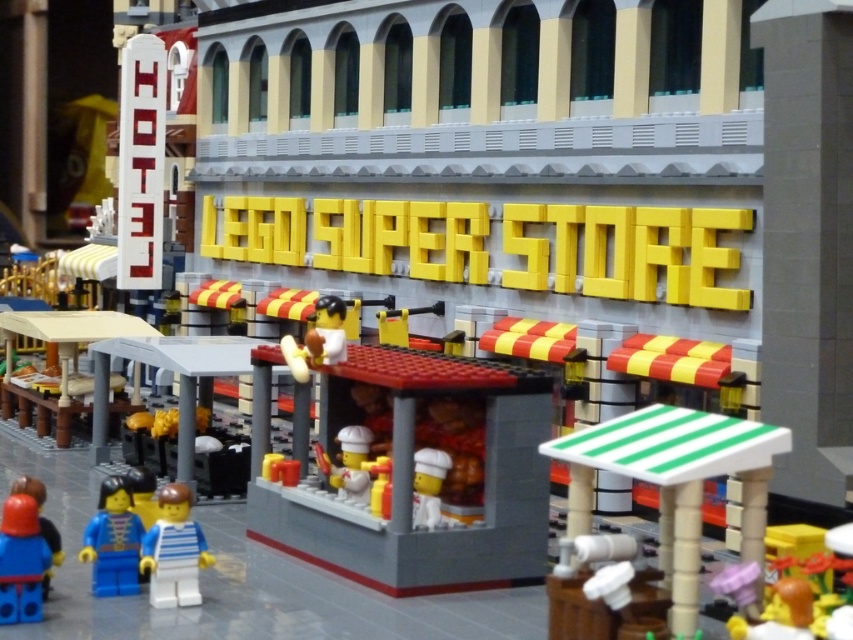
Question: Does light blue plastic minifigure at lower left lie in front of matte blue minifigure at lower left?

Choices:
 (A) yes
 (B) no

Answer: (B)

Question: Is gray matte pillar at right positioned in front of light blue plastic minifigure at lower left?

Choices:
 (A) yes
 (B) no

Answer: (B)

Question: Which point appears farthest from the camera in this image?

Choices:
 (A) (164, 528)
 (B) (10, 577)
 (C) (83, 556)
 (D) (830, 456)

Answer: (D)

Question: Which point is farther to the camera?

Choices:
 (A) blue plastic minifigure at lower left
 (B) matte blue minifigure at lower left
 (C) light blue plastic minifigure at lower left
 (D) gray matte pillar at right

Answer: (D)

Question: Does gray matte pillar at right have a smaller size compared to matte blue minifigure at lower left?

Choices:
 (A) yes
 (B) no

Answer: (B)

Question: Which point is farther to the camera?

Choices:
 (A) (103, 554)
 (B) (196, 532)
 (C) (776, 160)
 (D) (28, 604)

Answer: (C)